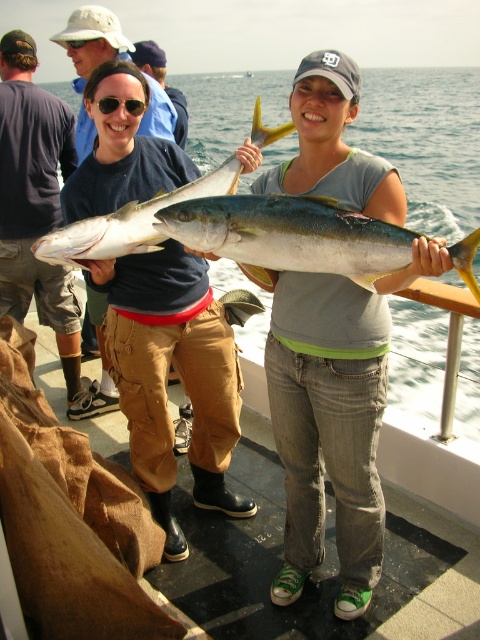
Question: Is matte blue shirt at center bigger than matte black shirt at left?

Choices:
 (A) no
 (B) yes

Answer: (A)

Question: Which point appears farthest from the camera in this image?

Choices:
 (A) (2, 140)
 (B) (200, 205)
 (C) (371, 528)

Answer: (A)

Question: Is yellow shiny fish at center smaller than shiny silver fish at center?

Choices:
 (A) yes
 (B) no

Answer: (A)

Question: Estimate the real-world distances between objects in this image. Which object is closer to the yellow shiny fish at center?

Choices:
 (A) shiny silver fish at center
 (B) matte black shirt at center
 (C) matte black shirt at left

Answer: (A)

Question: Is matte yellow fish at center further to camera compared to matte black shirt at left?

Choices:
 (A) yes
 (B) no

Answer: (B)

Question: Which point is closer to the camera?

Choices:
 (A) (335, 97)
 (B) (14, 307)

Answer: (A)